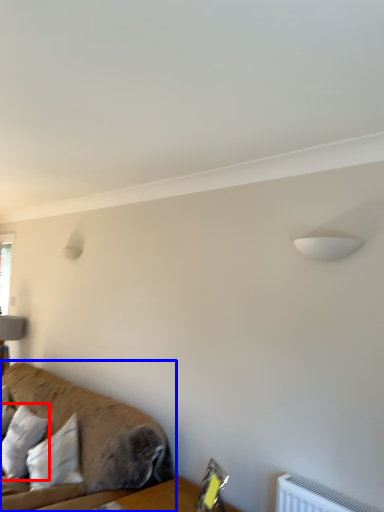
Question: Among these objects, which one is nearest to the camera, pillow (highlighted by a red box) or studio couch (highlighted by a blue box)?

Choices:
 (A) pillow
 (B) studio couch

Answer: (B)